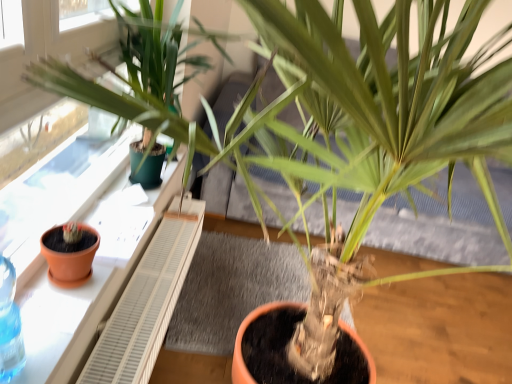
Locate an element on the screen. This screenshot has height=384, width=512. free space above terracotta clay pot at left (from a real-world perspective) is located at coordinates (102, 235).